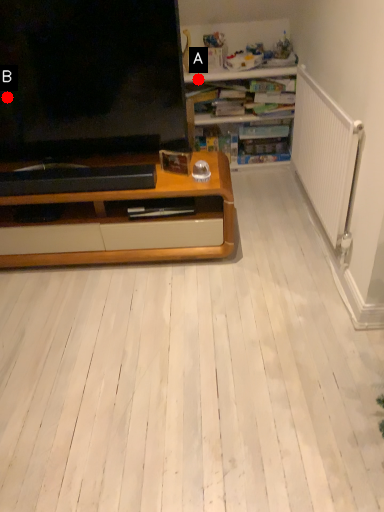
Question: Two points are circled on the image, labeled by A and B beside each circle. Which point is further to the camera?

Choices:
 (A) A is further
 (B) B is further

Answer: (A)